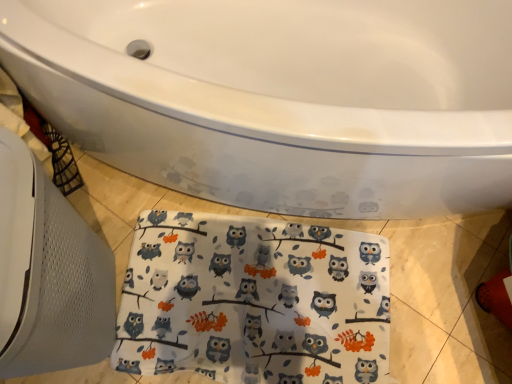
Describe the element at coordinates (282, 98) in the screenshot. The image size is (512, 384). I see `white glossy bathtub at center` at that location.

Locate an element on the screen. The image size is (512, 384). white glossy bathtub at center is located at coordinates (282, 98).

This screenshot has height=384, width=512. What do you see at coordinates (254, 301) in the screenshot?
I see `white fabric with owl print at lower center` at bounding box center [254, 301].

In order to click on white fabric with owl print at lower center in this screenshot , I will do `click(254, 301)`.

Locate an element on the screen. white glossy bathtub at center is located at coordinates (282, 98).

Considering the positions of objects white glossy bathtub at center and white fabric with owl print at lower center in the image provided, who is more to the right, white glossy bathtub at center or white fabric with owl print at lower center?

Positioned to the right is white glossy bathtub at center.

Which object is more forward, white glossy bathtub at center or white fabric with owl print at lower center?

white glossy bathtub at center.

Is point (313, 215) closer or farther from the camera than point (366, 336)?

Point (313, 215) appears to be farther away from the viewer than point (366, 336).

From the image's perspective, is white glossy bathtub at center positioned above or below white fabric with owl print at lower center?

white glossy bathtub at center is above white fabric with owl print at lower center.

From a real-world perspective, is white glossy bathtub at center over white fabric with owl print at lower center?

Yes, from a real-world perspective, white glossy bathtub at center is on top of white fabric with owl print at lower center.

Which of these two, white glossy bathtub at center or white fabric with owl print at lower center, is wider?

white glossy bathtub at center.

Considering the sizes of white glossy bathtub at center and white fabric with owl print at lower center in the image, is white glossy bathtub at center taller or shorter than white fabric with owl print at lower center?

Considering their sizes, white glossy bathtub at center has more height than white fabric with owl print at lower center.

Consider the image. Who is smaller, white glossy bathtub at center or white fabric with owl print at lower center?

white fabric with owl print at lower center is smaller.

Does white glossy bathtub at center contain white fabric with owl print at lower center?

No, white fabric with owl print at lower center is not a part of white glossy bathtub at center.

Does white glossy bathtub at center touch white fabric with owl print at lower center?

No, white glossy bathtub at center is not beside white fabric with owl print at lower center.

Is white glossy bathtub at center positioned with its back to white fabric with owl print at lower center?

white glossy bathtub at center is not turned away from white fabric with owl print at lower center.

How much distance is there between white glossy bathtub at center and white fabric with owl print at lower center?

white glossy bathtub at center and white fabric with owl print at lower center are 13.73 inches apart from each other.

Where is `bathtub above the white fabric with owl print at lower center (from a real-world perspective)`? bathtub above the white fabric with owl print at lower center (from a real-world perspective) is located at coordinates (282, 98).

Is white fabric with owl print at lower center to the left of white glossy bathtub at center from the viewer's perspective?

Correct, you'll find white fabric with owl print at lower center to the left of white glossy bathtub at center.

Which is in front, white fabric with owl print at lower center or white glossy bathtub at center?

white glossy bathtub at center is in front.

Considering the positions of points (384, 243) and (348, 52), is point (384, 243) farther from camera compared to point (348, 52)?

No, it is not.

From the image's perspective, which one is positioned higher, white fabric with owl print at lower center or white glossy bathtub at center?

white glossy bathtub at center is shown above in the image.

From a real-world perspective, is white fabric with owl print at lower center on white glossy bathtub at center?

No.

Between white fabric with owl print at lower center and white glossy bathtub at center, which one has smaller width?

white fabric with owl print at lower center.

Can you confirm if white fabric with owl print at lower center is taller than white glossy bathtub at center?

In fact, white fabric with owl print at lower center may be shorter than white glossy bathtub at center.

Between white fabric with owl print at lower center and white glossy bathtub at center, which one has smaller size?

white fabric with owl print at lower center is smaller.

Based on the photo, is white fabric with owl print at lower center surrounding white glossy bathtub at center?

No, white fabric with owl print at lower center does not contain white glossy bathtub at center.

Would you consider white fabric with owl print at lower center to be distant from white glossy bathtub at center?

No, white fabric with owl print at lower center is not far from white glossy bathtub at center.

Is white fabric with owl print at lower center looking in the opposite direction of white glossy bathtub at center?

Yes.

How different are the orientations of white fabric with owl print at lower center and white glossy bathtub at center in degrees?

2.4 degrees separate the facing orientations of white fabric with owl print at lower center and white glossy bathtub at center.

The width and height of the screenshot is (512, 384). In order to click on bathtub above the white fabric with owl print at lower center (from the image's perspective) in this screenshot , I will do `click(282, 98)`.

Where is `beach towel behind the white glossy bathtub at center`? The width and height of the screenshot is (512, 384). beach towel behind the white glossy bathtub at center is located at coordinates (254, 301).

Locate an element on the screen. Image resolution: width=512 pixels, height=384 pixels. bathtub above the white fabric with owl print at lower center (from the image's perspective) is located at coordinates (282, 98).